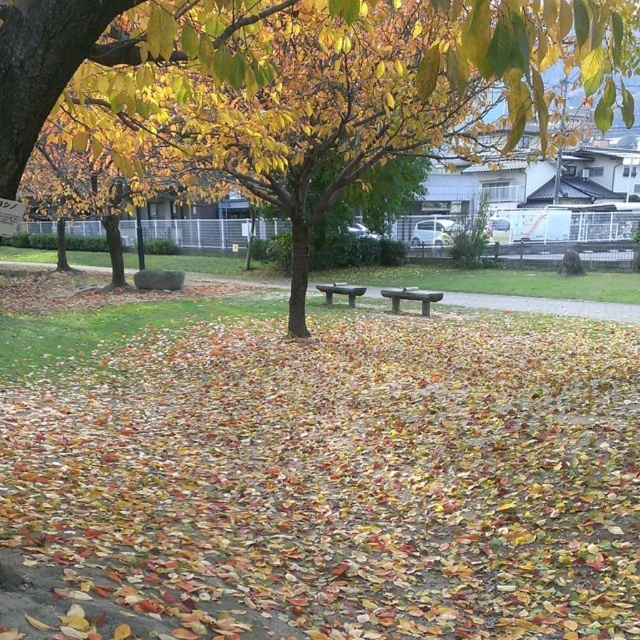
You are a gardener who needs to clear the pathway. You see the multicolored leaf litter at center and the green stone bench at center. Which object is closer to you as you stand at the start of the pathway?

The multicolored leaf litter at center is closer to you because it is in front of the green stone bench at center.

You are standing at the starting point of the pathway in the autumn park scene. You notice two points marked on the path ahead. The first point is at coordinates point (x=595, y=570) and the second is at point (x=493, y=83). If you want to reach the point that is closer to you, which coordinate should you head towards?

Point (x=595, y=570) is in front of point (x=493, y=83), so the closer point to you is point (x=595, y=570).

You are standing at the entrance of the park and see the autumn scene described. There is a point marked at coordinates point (x=403, y=88). What does this point represent in the scene?

The point (x=403, y=88) represents the location of the yellow green leaves at upper center.